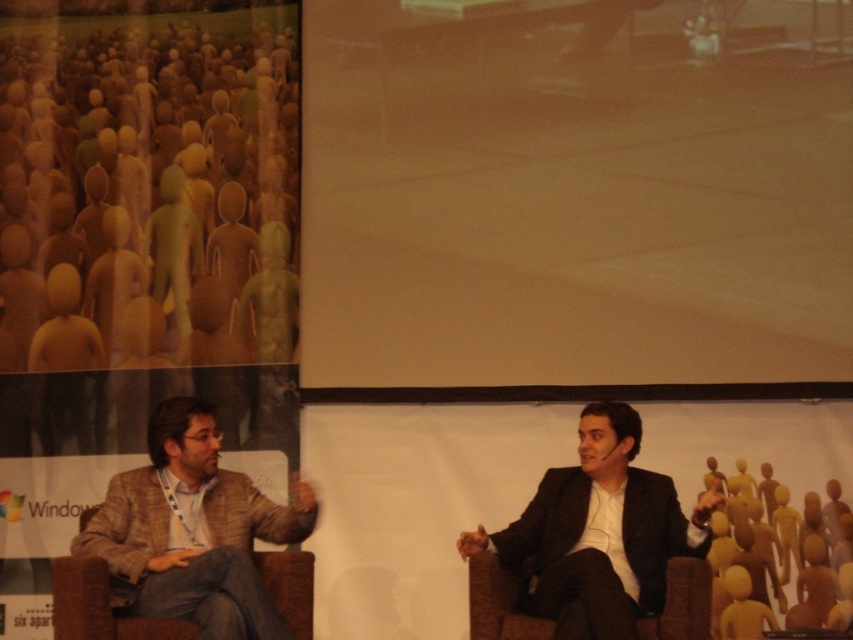
Question: Which is nearer to the black suit at center?

Choices:
 (A) brown fabric chair at lower right
 (B) matte white screen at center

Answer: (A)

Question: Is plaid wool blazer at left below brown fabric chair at lower right?

Choices:
 (A) yes
 (B) no

Answer: (B)

Question: Is matte white screen at center below brown fabric chair at lower right?

Choices:
 (A) no
 (B) yes

Answer: (A)

Question: Among these points, which one is nearest to the camera?

Choices:
 (A) (544, 634)
 (B) (502, 64)

Answer: (A)

Question: Considering the real-world distances, which object is farthest from the black suit at center?

Choices:
 (A) matte white screen at center
 (B) brown fabric chair at lower right

Answer: (A)

Question: Can you confirm if matte white screen at center is wider than black suit at center?

Choices:
 (A) yes
 (B) no

Answer: (A)